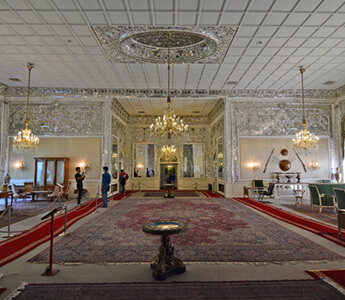
Where is `concrete floor`? The width and height of the screenshot is (345, 300). concrete floor is located at coordinates [x=33, y=274].